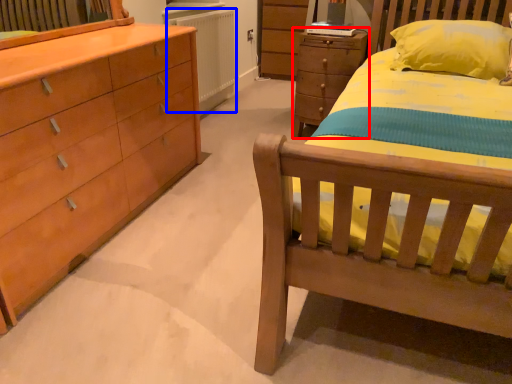
Question: Which object appears closest to the camera in this image, chest of drawers (highlighted by a red box) or radiator (highlighted by a blue box)?

Choices:
 (A) chest of drawers
 (B) radiator

Answer: (A)